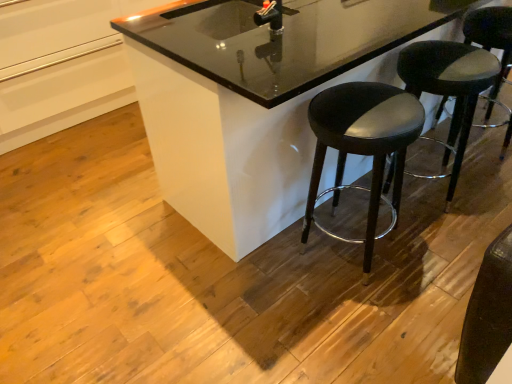
Question: Considering the positions of black leather stool at center, the first stool in the left-to-right sequence, and black glossy counter at center in the image, is black leather stool at center, the first stool in the left-to-right sequence, taller or shorter than black glossy counter at center?

Choices:
 (A) tall
 (B) short

Answer: (B)

Question: Is point (317, 177) positioned closer to the camera than point (247, 195)?

Choices:
 (A) closer
 (B) farther

Answer: (A)

Question: Estimate the real-world distances between objects in this image. Which object is farther from the black leather stool at center, the first stool in the left-to-right sequence?

Choices:
 (A) black leather stool at lower right, which is the second stool from right to left
 (B) black glossy sink at upper center
 (C) black leather stool at right, placed as the first stool when sorted from right to left
 (D) black glossy counter at center

Answer: (B)

Question: Estimate the real-world distances between objects in this image. Which object is closer to the black leather stool at right, placed as the first stool when sorted from right to left?

Choices:
 (A) black leather stool at lower right, which is the 2th stool in left-to-right order
 (B) black leather stool at center, which is the 3th stool in right-to-left order
 (C) black glossy sink at upper center
 (D) black glossy counter at center

Answer: (A)